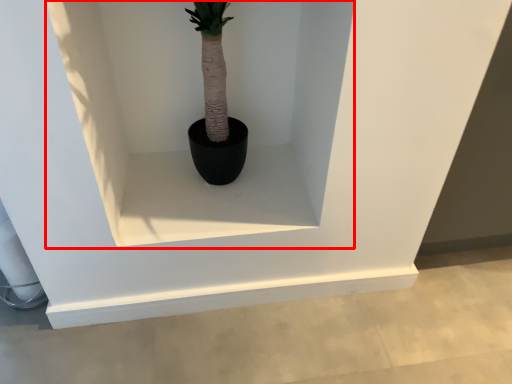
Question: From the image's perspective, considering the relative positions of shelf (annotated by the red box) and window sill in the image provided, where is shelf (annotated by the red box) located with respect to the staircase?

Choices:
 (A) below
 (B) above

Answer: (B)